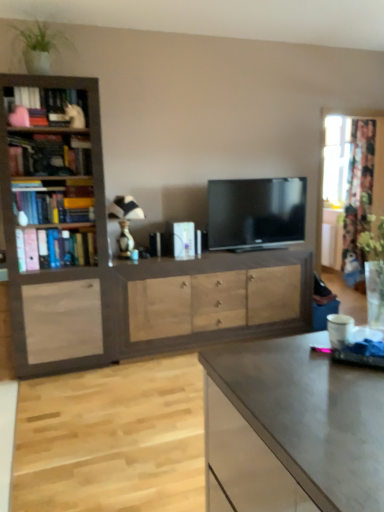
Question: Considering the relative sizes of light wood drawer at center and green leafy plant at upper left in the image provided, is light wood drawer at center taller than green leafy plant at upper left?

Choices:
 (A) yes
 (B) no

Answer: (A)

Question: Is light wood drawer at center positioned before green leafy plant at upper left?

Choices:
 (A) yes
 (B) no

Answer: (B)

Question: Is light wood drawer at center touching green leafy plant at upper left?

Choices:
 (A) yes
 (B) no

Answer: (B)

Question: Is light wood drawer at center further to the viewer compared to green leafy plant at upper left?

Choices:
 (A) yes
 (B) no

Answer: (A)

Question: From the image's perspective, does light wood drawer at center appear higher than green leafy plant at upper left?

Choices:
 (A) no
 (B) yes

Answer: (A)

Question: From a real-world perspective, is light wood drawer at center positioned under green leafy plant at upper left based on gravity?

Choices:
 (A) no
 (B) yes

Answer: (B)

Question: Considering the relative sizes of green leafy plant at upper left and wooden bookcase at left in the image provided, is green leafy plant at upper left smaller than wooden bookcase at left?

Choices:
 (A) yes
 (B) no

Answer: (A)

Question: From the image's perspective, is green leafy plant at upper left over wooden bookcase at left?

Choices:
 (A) no
 (B) yes

Answer: (B)

Question: Is green leafy plant at upper left positioned with its back to wooden bookcase at left?

Choices:
 (A) no
 (B) yes

Answer: (A)

Question: Can you confirm if green leafy plant at upper left is shorter than wooden bookcase at left?

Choices:
 (A) no
 (B) yes

Answer: (B)

Question: Does green leafy plant at upper left appear on the right side of wooden bookcase at left?

Choices:
 (A) no
 (B) yes

Answer: (A)

Question: From a real-world perspective, is green leafy plant at upper left below wooden bookcase at left?

Choices:
 (A) yes
 (B) no

Answer: (B)

Question: Would you say wooden bookcase at left is part of black glossy tv at center's contents?

Choices:
 (A) yes
 (B) no

Answer: (B)